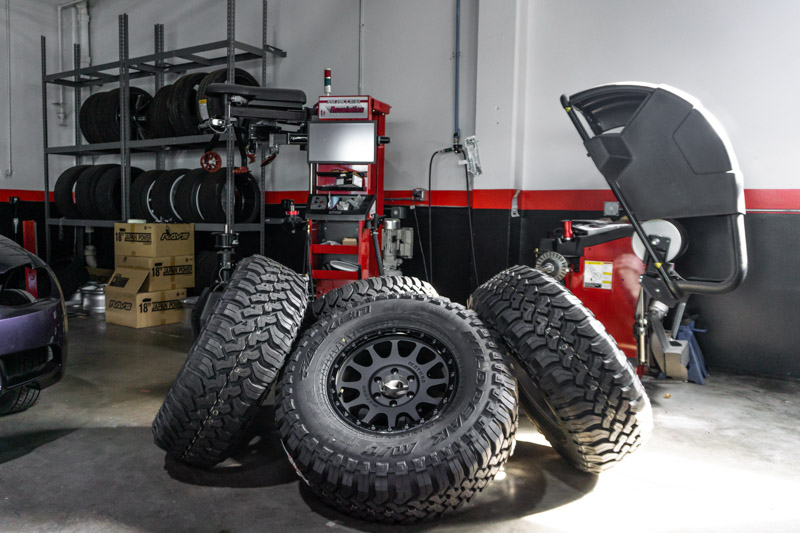
Where is `boxes`? boxes is located at coordinates (128, 304), (173, 246).